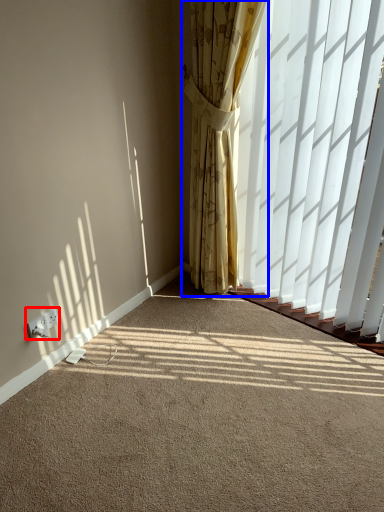
Question: Among these objects, which one is nearest to the camera, electric outlet (highlighted by a red box) or curtain (highlighted by a blue box)?

Choices:
 (A) electric outlet
 (B) curtain

Answer: (B)